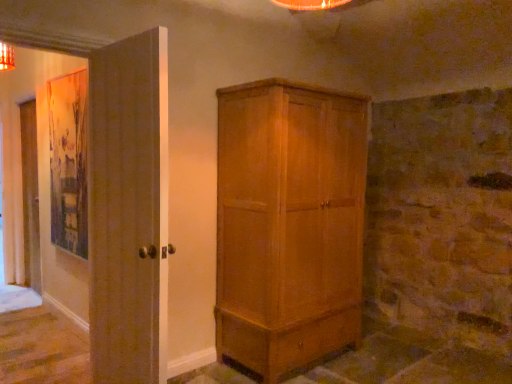
Question: Is matte brown door at left wider or thinner than light brown wood cupboard at center?

Choices:
 (A) wide
 (B) thin

Answer: (B)

Question: Visually, is matte brown door at left positioned to the left or to the right of light brown wood cupboard at center?

Choices:
 (A) right
 (B) left

Answer: (B)

Question: Does point (101, 69) appear closer or farther from the camera than point (229, 344)?

Choices:
 (A) closer
 (B) farther

Answer: (A)

Question: Is light brown wood cupboard at center wider or thinner than matte brown door at left?

Choices:
 (A) thin
 (B) wide

Answer: (B)

Question: From the image's perspective, relative to matte brown door at left, is light brown wood cupboard at center above or below?

Choices:
 (A) below
 (B) above

Answer: (A)

Question: From a real-world perspective, is light brown wood cupboard at center positioned above or below matte brown door at left?

Choices:
 (A) below
 (B) above

Answer: (A)

Question: Would you say light brown wood cupboard at center is inside or outside matte brown door at left?

Choices:
 (A) inside
 (B) outside

Answer: (B)